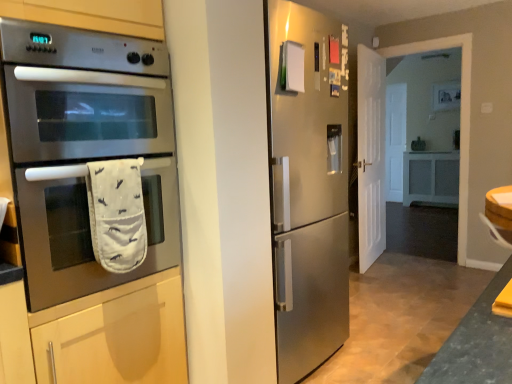
Measure the distance between stainless steel oven at left and camera.

stainless steel oven at left and camera are 3.99 feet apart.

Measure the distance between point [131,216] and camera.

Point [131,216] is 1.48 meters from camera.

Image resolution: width=512 pixels, height=384 pixels. Find the location of `white fabric oven mitt at lower left`. white fabric oven mitt at lower left is located at coordinates (117, 214).

In order to click on stainless steel oven at left in this screenshot , I will do `click(84, 148)`.

Is white fabric oven mitt at lower left in front of white matte door at right?

Yes, the depth of white fabric oven mitt at lower left is less than that of white matte door at right.

Is point (136, 180) closer to viewer compared to point (382, 236)?

Yes, it is in front of point (382, 236).

Between white fabric oven mitt at lower left and white matte door at right, which one has less height?

Standing shorter between the two is white fabric oven mitt at lower left.

Does stainless steel oven at left appear on the left side of white matte door at right?

Correct, you'll find stainless steel oven at left to the left of white matte door at right.

Consider the image. Is stainless steel oven at left bigger than white matte door at right?

Correct, stainless steel oven at left is larger in size than white matte door at right.

Based on the photo, how many degrees apart are the facing directions of stainless steel oven at left and white matte door at right?

The angle between the facing direction of stainless steel oven at left and the facing direction of white matte door at right is 12.1 degrees.

From the image's perspective, is white matte door at right on white fabric oven mitt at lower left?

Yes, from the image's perspective, white matte door at right is on top of white fabric oven mitt at lower left.

Which object is more forward, white matte door at right or white fabric oven mitt at lower left?

Positioned in front is white fabric oven mitt at lower left.

Considering the sizes of objects white matte door at right and white fabric oven mitt at lower left in the image provided, who is bigger, white matte door at right or white fabric oven mitt at lower left?

white matte door at right is bigger.

Is stainless steel oven at left in front of or behind white fabric oven mitt at lower left in the image?

stainless steel oven at left is positioned closer to the viewer than white fabric oven mitt at lower left.

Is stainless steel oven at left looking in the opposite direction of white fabric oven mitt at lower left?

That's not correct — stainless steel oven at left is not looking away from white fabric oven mitt at lower left.

How different are the orientations of stainless steel oven at left and white fabric oven mitt at lower left in degrees?

stainless steel oven at left and white fabric oven mitt at lower left are facing 0.000104 degrees away from each other.

How distant is stainless steel oven at left from white fabric oven mitt at lower left?

A distance of 6.72 inches exists between stainless steel oven at left and white fabric oven mitt at lower left.

Considering the sizes of objects white fabric oven mitt at lower left and stainless steel oven at left in the image provided, who is thinner, white fabric oven mitt at lower left or stainless steel oven at left?

white fabric oven mitt at lower left is thinner.

Is white fabric oven mitt at lower left turned away from stainless steel oven at left?

Yes, white fabric oven mitt at lower left's orientation is away from stainless steel oven at left.

From the image's perspective, is white fabric oven mitt at lower left on top of stainless steel oven at left?

No.

The image size is (512, 384). Find the location of `microwave oven in front of the white fabric oven mitt at lower left`. microwave oven in front of the white fabric oven mitt at lower left is located at coordinates (84, 148).

Where is `door above the stainless steel oven at left (from the image's perspective)`? The height and width of the screenshot is (384, 512). door above the stainless steel oven at left (from the image's perspective) is located at coordinates (371, 155).

From the picture: Is stainless steel oven at left surrounded by white matte door at right?

No.

Considering the relative positions of white matte door at right and stainless steel oven at left in the image provided, is white matte door at right to the left of stainless steel oven at left from the viewer's perspective?

Incorrect, white matte door at right is not on the left side of stainless steel oven at left.

Is the position of white matte door at right more distant than that of stainless steel oven at left?

Yes.

Identify the location of door above the white fabric oven mitt at lower left (from the image's perspective). The width and height of the screenshot is (512, 384). (371, 155).

The height and width of the screenshot is (384, 512). Identify the location of microwave oven above the white matte door at right (from a real-world perspective). (84, 148).

When comparing their distances from white fabric oven mitt at lower left, does stainless steel oven at left or white matte door at right seem closer?

The object closer to white fabric oven mitt at lower left is stainless steel oven at left.

Estimate the real-world distances between objects in this image. Which object is closer to white fabric oven mitt at lower left, white matte door at right or stainless steel oven at left?

stainless steel oven at left is positioned closer to the anchor white fabric oven mitt at lower left.

Considering their positions, is white fabric oven mitt at lower left positioned closer to stainless steel oven at left than white matte door at right?

Based on the image, white fabric oven mitt at lower left appears to be nearer to stainless steel oven at left.

Based on their spatial positions, is white fabric oven mitt at lower left or stainless steel oven at left closer to white matte door at right?

stainless steel oven at left is closer to white matte door at right.

Which object lies further to the anchor point white matte door at right, stainless steel oven at left or white fabric oven mitt at lower left?

Among the two, white fabric oven mitt at lower left is located further to white matte door at right.

Looking at the image, which one is located further to stainless steel oven at left, white matte door at right or white fabric oven mitt at lower left?

Based on the image, white matte door at right appears to be further to stainless steel oven at left.

Locate an element on the screen. The height and width of the screenshot is (384, 512). hand towel between stainless steel oven at left and white matte door at right from front to back is located at coordinates (117, 214).